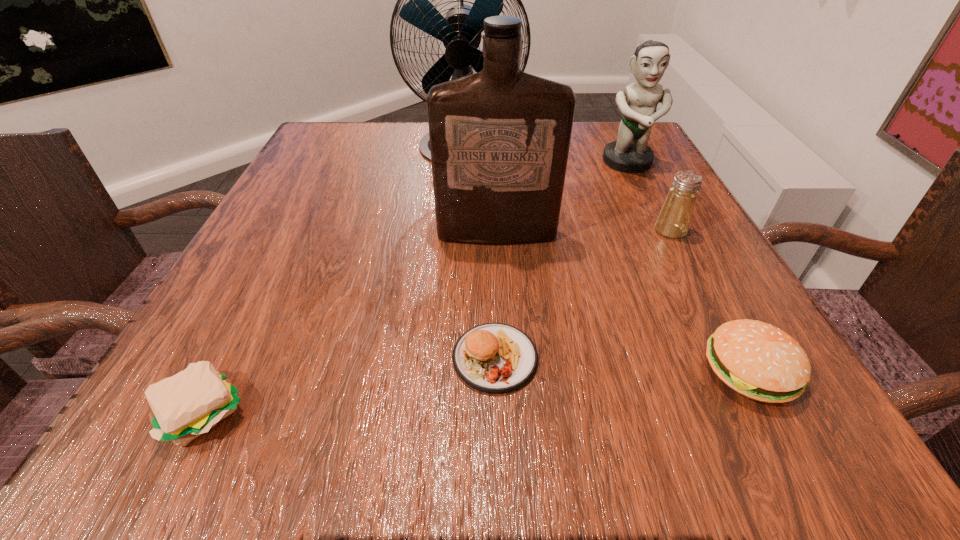
Locate an element on the screen. free space between the second patty from right to left and the saltshaker is located at coordinates (583, 294).

At what (x,y) coordinates should I click in order to perform the action: click on unoccupied area between the second patty from right to left and the third tallest object. Please return your answer as a coordinate pair (x, y). Looking at the image, I should click on (562, 261).

Locate an element on the screen. The height and width of the screenshot is (540, 960). free space between the figurine and the liquor is located at coordinates (563, 199).

Where is `vacant area that lies between the figurine and the rightmost patty`? vacant area that lies between the figurine and the rightmost patty is located at coordinates (688, 267).

Where is `empty space that is in between the leftmost object and the saltshaker`? empty space that is in between the leftmost object and the saltshaker is located at coordinates (438, 321).

At what (x,y) coordinates should I click in order to perform the action: click on free spot between the liquor and the fifth shortest object. Please return your answer as a coordinate pair (x, y). The height and width of the screenshot is (540, 960). Looking at the image, I should click on (563, 199).

In order to click on free space that is in between the rightmost patty and the second patty from right to left in this screenshot , I will do `click(622, 364)`.

Locate an element on the screen. free space that is in between the leftmost object and the rightmost patty is located at coordinates (477, 391).

Where is `unoccupied position between the rightmost patty and the third tallest object`? The image size is (960, 540). unoccupied position between the rightmost patty and the third tallest object is located at coordinates (688, 267).

Where is `vacant area that lies between the fourth shortest object and the leftmost patty`? This screenshot has height=540, width=960. vacant area that lies between the fourth shortest object and the leftmost patty is located at coordinates (438, 321).